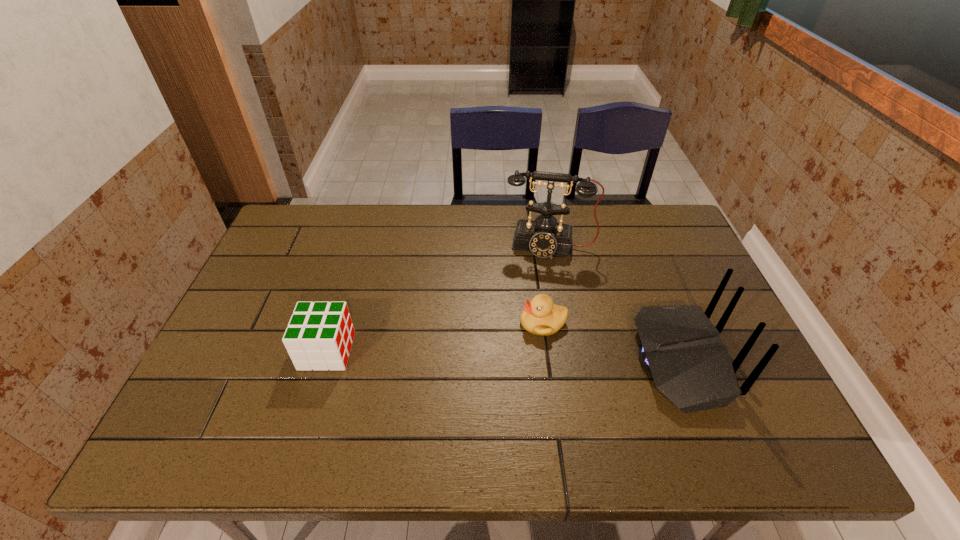
Find the location of a particular element. free space on the desktop that is between the leftmost object and the rightmost object and is positioned on the dial of the tallest object is located at coordinates (539, 356).

In order to click on vacant space on the desktop that is between the cube and the rightmost object and is positioned on the front-facing side of the shortest object in this screenshot , I will do `click(475, 355)`.